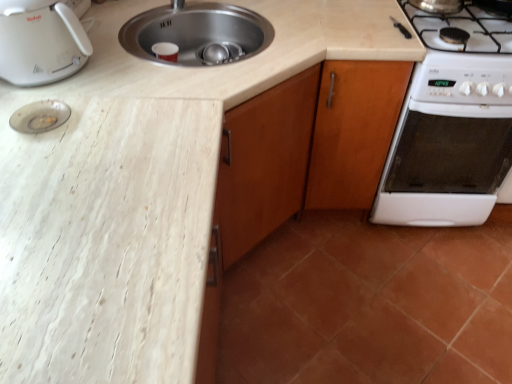
I want to click on free area behind white plastic toaster at upper left, so click(114, 21).